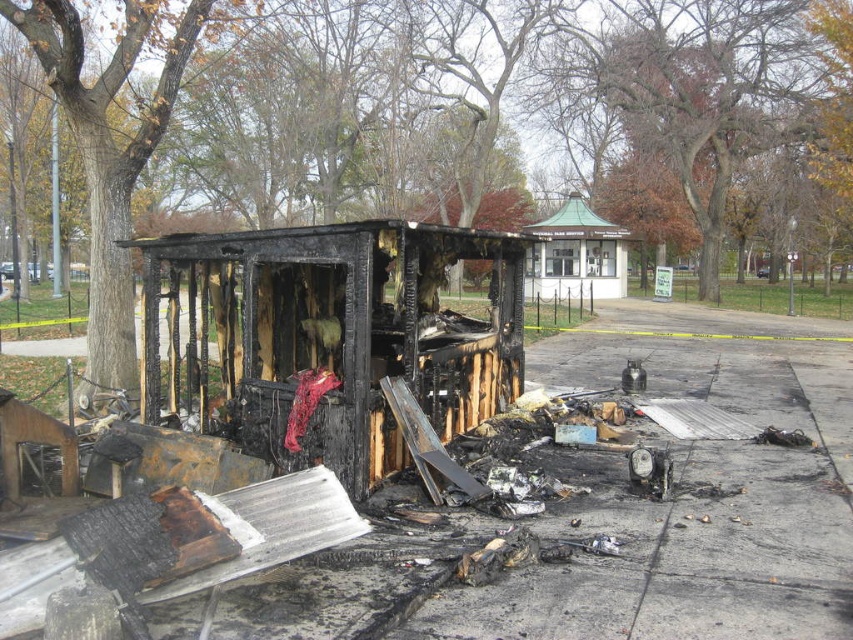
Consider the image. You are a drone operator tasked with assessing damage after a fire. You need to locate the charcoal wood gazebo at center for inspection. Based on the coordinates provided, where should you direct the drone to focus?

The charcoal wood gazebo at center is located at point [335,337], so direct the drone to focus there for inspection.

You are a firefighter assessing the damage after a fire. You see the charcoal wood gazebo at center and the green metal gazebo at upper center. Which gazebo is positioned to the left side of the other?

The charcoal wood gazebo at center is to the left of green metal gazebo at upper center.